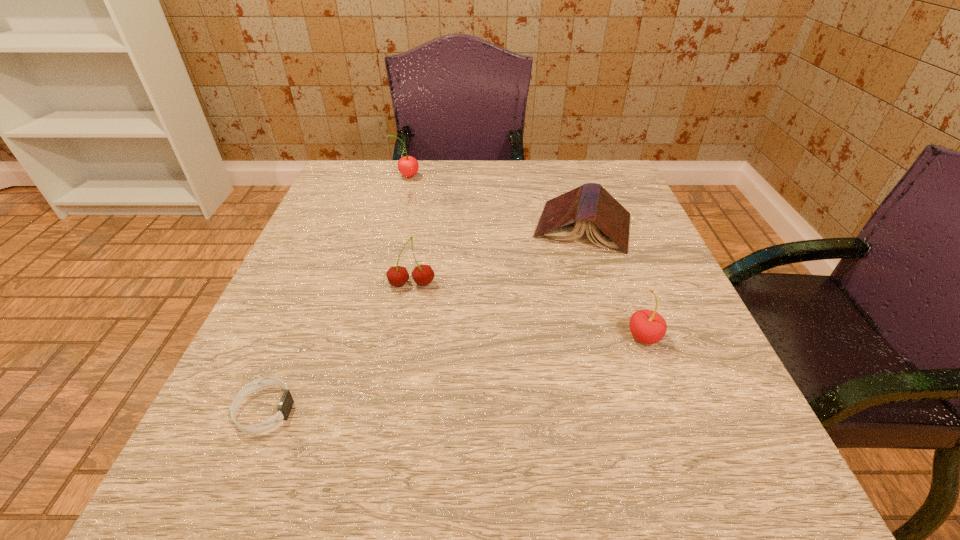
Locate an element on the screen. Image resolution: width=960 pixels, height=540 pixels. the farthest cherry is located at coordinates (408, 166).

This screenshot has width=960, height=540. Identify the location of the third nearest object. (423, 275).

The image size is (960, 540). Identify the location of the nearest cherry. (647, 326).

Locate an element on the screen. This screenshot has height=540, width=960. the rightmost cherry is located at coordinates (647, 326).

You are a GUI agent. You are given a task and a screenshot of the screen. Output one action in this format:
    pyautogui.click(x=<x>, y=<y>)
    Task: Click on the book
    This screenshot has height=540, width=960.
    Given the screenshot: What is the action you would take?
    pyautogui.click(x=564, y=218)

Image resolution: width=960 pixels, height=540 pixels. I want to click on the second farthest object, so [564, 218].

The image size is (960, 540). Identify the location of the shortest object. (285, 405).

What are the coordinates of `wristband` in the screenshot? It's located at (285, 405).

Where is `vacant space situated on the right of the farthest object`? The image size is (960, 540). vacant space situated on the right of the farthest object is located at coordinates (470, 177).

Find the location of a particular element. The height and width of the screenshot is (540, 960). vacant space situated 0.290m on the surface of the second farthest cherry is located at coordinates (384, 442).